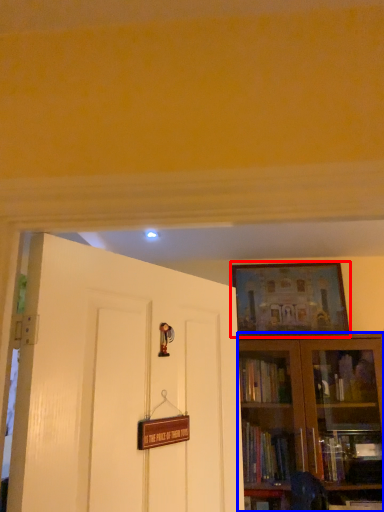
Question: Which object is further to the camera taking this photo, picture frame (highlighted by a red box) or bookcase (highlighted by a blue box)?

Choices:
 (A) picture frame
 (B) bookcase

Answer: (A)